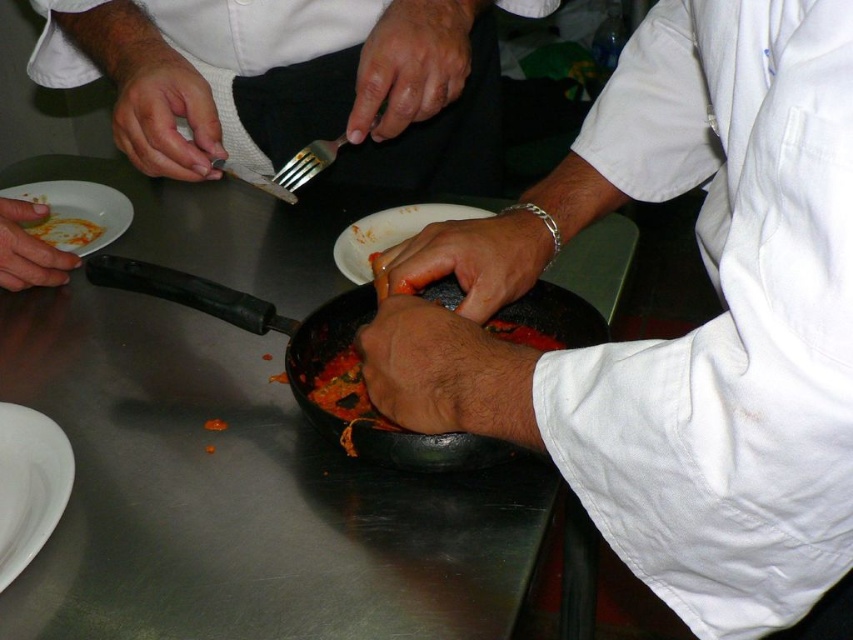
Question: Can you confirm if dark skin/hair at center is smaller than smooth gray glove at center?

Choices:
 (A) yes
 (B) no

Answer: (B)

Question: Can you confirm if white matte plate at center is positioned above matte white plate at left?

Choices:
 (A) yes
 (B) no

Answer: (A)

Question: Which of the following is the farthest from the observer?

Choices:
 (A) (344, 344)
 (B) (73, 236)
 (C) (10, 248)

Answer: (B)

Question: Which object is closer to the camera taking this photo?

Choices:
 (A) black matte wok at center
 (B) smooth gray glove at center

Answer: (A)

Question: Can you confirm if white matte plate at left is smaller than silver metallic fork at center?

Choices:
 (A) yes
 (B) no

Answer: (A)

Question: Among these points, which one is farthest from the camera?

Choices:
 (A) (368, 273)
 (B) (804, 72)

Answer: (A)